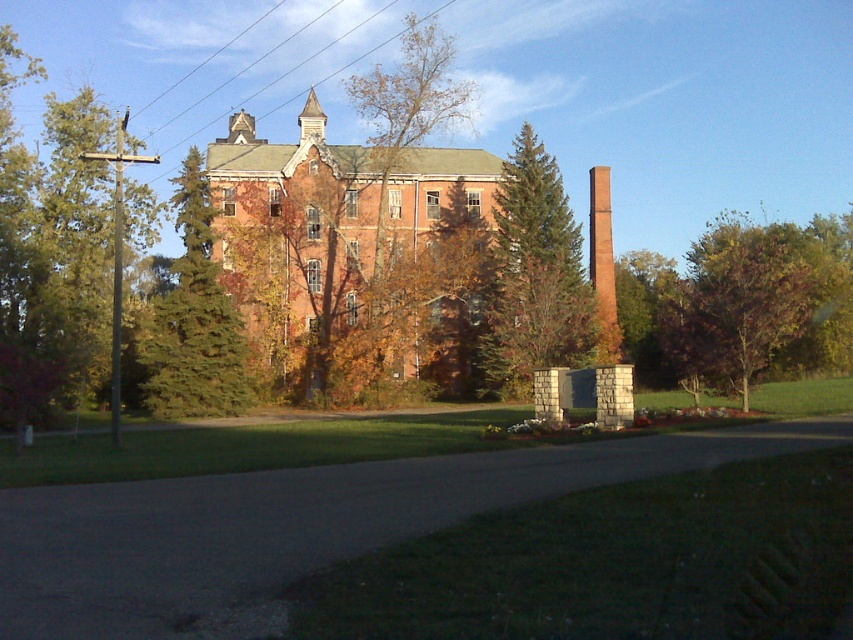
Is green coniferous tree at center closer to the viewer compared to brown leafy tree at center?

Yes, it is in front of brown leafy tree at center.

Is point (201, 241) closer to viewer compared to point (386, 154)?

Yes, it is.

Locate an element on the screen. green coniferous tree at center is located at coordinates (194, 320).

Can you confirm if purple leafy tree at right is thinner than brown leafy tree at center?

In fact, purple leafy tree at right might be wider than brown leafy tree at center.

Identify the location of purple leafy tree at right. This screenshot has width=853, height=640. (735, 305).

Where is `purple leafy tree at right`? The height and width of the screenshot is (640, 853). purple leafy tree at right is located at coordinates (735, 305).

Where is `purple leafy tree at right`? This screenshot has width=853, height=640. purple leafy tree at right is located at coordinates (735, 305).

Who is shorter, brown leafy tree at center or red brick chimney at center-right?

red brick chimney at center-right is shorter.

Describe the element at coordinates (408, 108) in the screenshot. The image size is (853, 640). I see `brown leafy tree at center` at that location.

Locate an element on the screen. The height and width of the screenshot is (640, 853). brown leafy tree at center is located at coordinates (408, 108).